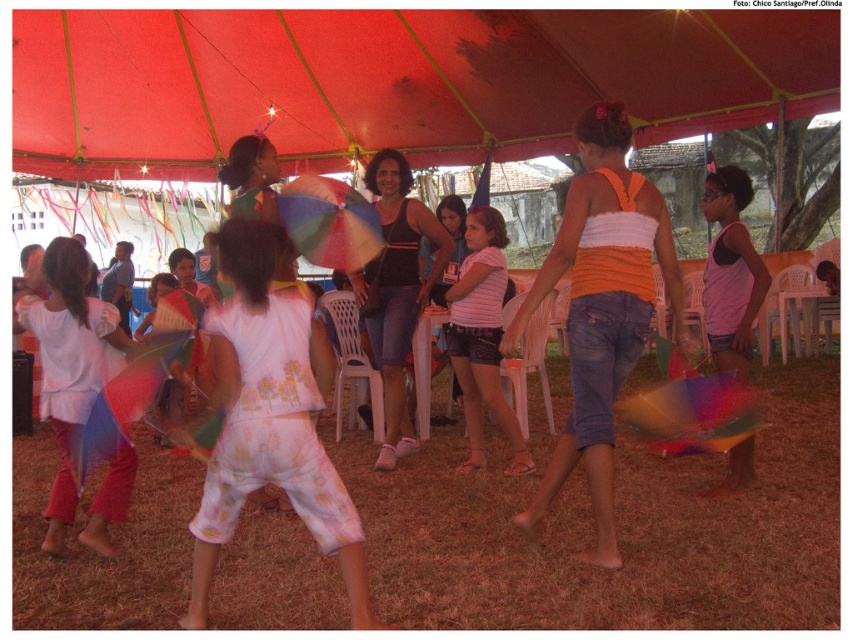
Question: Does red fabric canopy at upper center appear on the left side of pink striped shirt at center?

Choices:
 (A) no
 (B) yes

Answer: (B)

Question: Is red fabric canopy at upper center in front of pink striped shirt at center?

Choices:
 (A) no
 (B) yes

Answer: (A)

Question: Is red fabric canopy at upper center to the left of white floral-patterned jumpsuit at center from the viewer's perspective?

Choices:
 (A) no
 (B) yes

Answer: (B)

Question: Among these objects, which one is nearest to the camera?

Choices:
 (A) white floral-patterned jumpsuit at center
 (B) red fabric canopy at upper center
 (C) pink striped shirt at center

Answer: (A)

Question: Which point is closer to the camera?

Choices:
 (A) coord(788,33)
 (B) coord(267,241)
 (C) coord(457,384)

Answer: (B)

Question: Which point appears farthest from the camera in this image?

Choices:
 (A) (248, 22)
 (B) (473, 300)

Answer: (A)